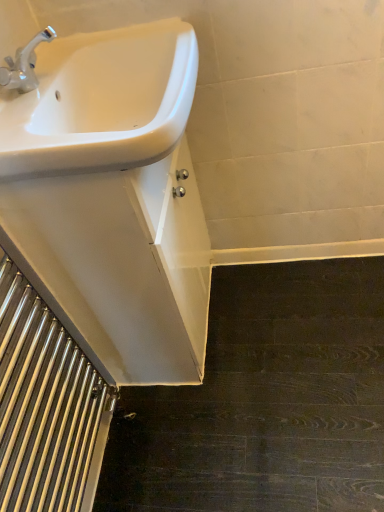
Question: Considering the positions of polished stainless steel stairwell at lower left and white glossy sink at upper left in the image, is polished stainless steel stairwell at lower left taller or shorter than white glossy sink at upper left?

Choices:
 (A) tall
 (B) short

Answer: (A)

Question: Is polished stainless steel stairwell at lower left situated inside white glossy sink at upper left or outside?

Choices:
 (A) outside
 (B) inside

Answer: (A)

Question: From the image's perspective, is polished stainless steel stairwell at lower left located above or below white glossy sink at upper left?

Choices:
 (A) above
 (B) below

Answer: (B)

Question: Would you say white glossy sink at upper left is to the left or to the right of polished stainless steel stairwell at lower left in the picture?

Choices:
 (A) left
 (B) right

Answer: (B)

Question: Choose the correct answer: Is white glossy sink at upper left inside polished stainless steel stairwell at lower left or outside it?

Choices:
 (A) outside
 (B) inside

Answer: (A)

Question: Considering the positions of point (99, 131) and point (28, 382), is point (99, 131) closer or farther from the camera than point (28, 382)?

Choices:
 (A) farther
 (B) closer

Answer: (A)

Question: Is white glossy sink at upper left wider or thinner than polished stainless steel stairwell at lower left?

Choices:
 (A) thin
 (B) wide

Answer: (B)